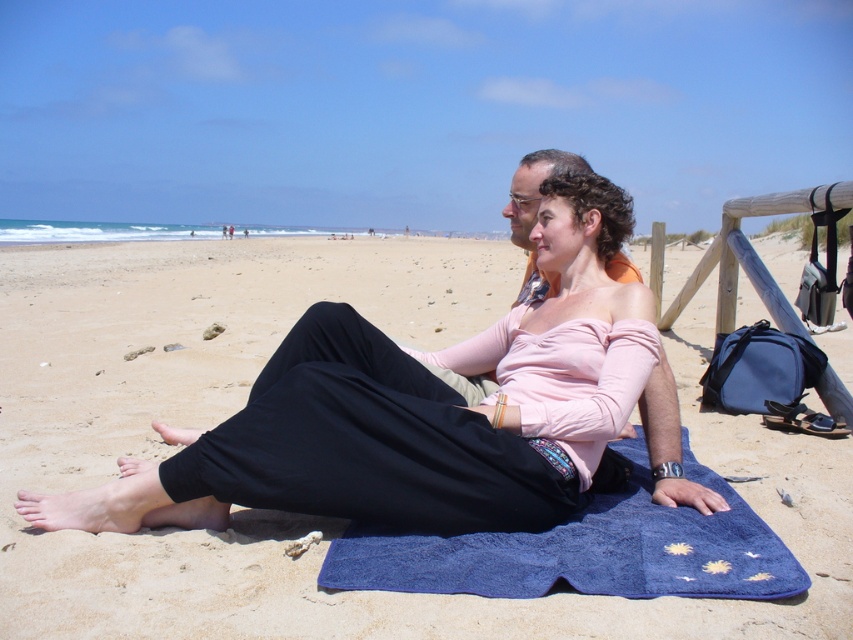
You are standing on the beach and see the matte black pants at center and the blue fabric towel at lower center. Which object is located to the left of the other?

The matte black pants at center is positioned on the left side of blue fabric towel at lower center.

From the picture: You are standing at the center of the beach scene. There is a point marked at coordinates (401, 413). What object is located at that point?

The point at coordinates (401, 413) is occupied by matte black pants at center.